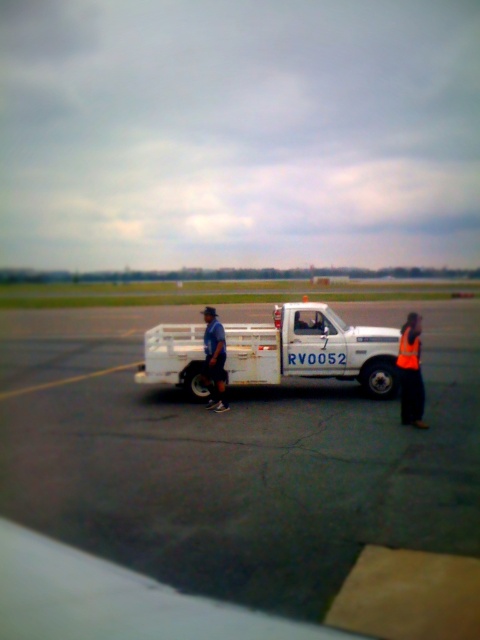
Looking at this image, you are a pilot preparing to taxi the plane. You need to ensure there is enough space between the white smooth tarmac at center and the orange fabric safety vest at right to avoid any collision. Based on their sizes, which one occupies more area in the image?

The white smooth tarmac at center is larger in size than the orange fabric safety vest at right, so it occupies more area in the image.